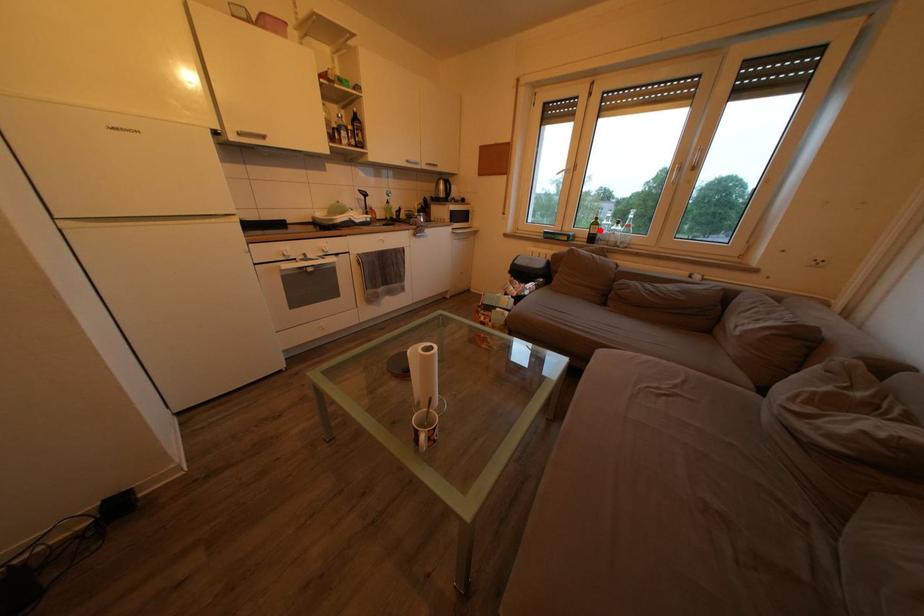
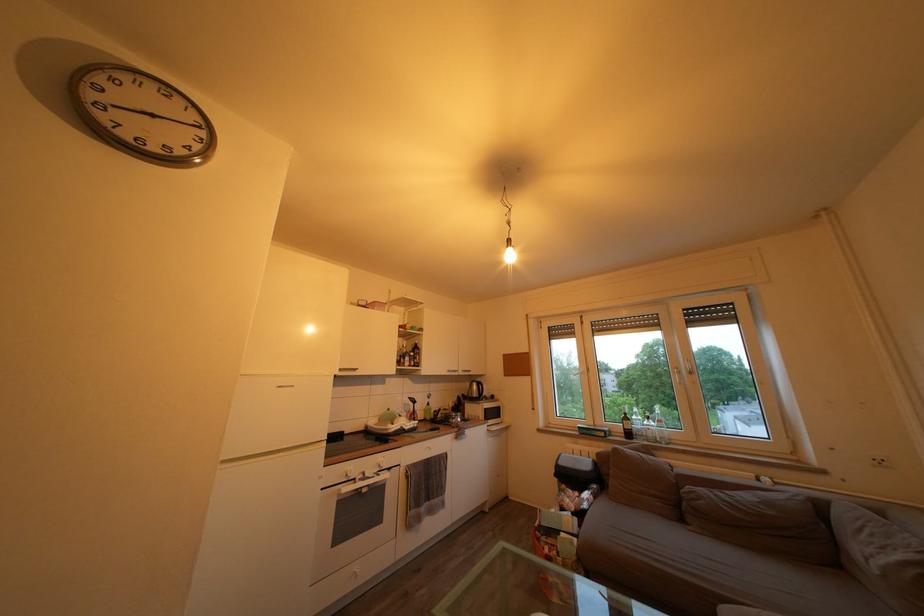
In the second image, find the point that corresponds to the highlighted location in the first image.

(630, 426)